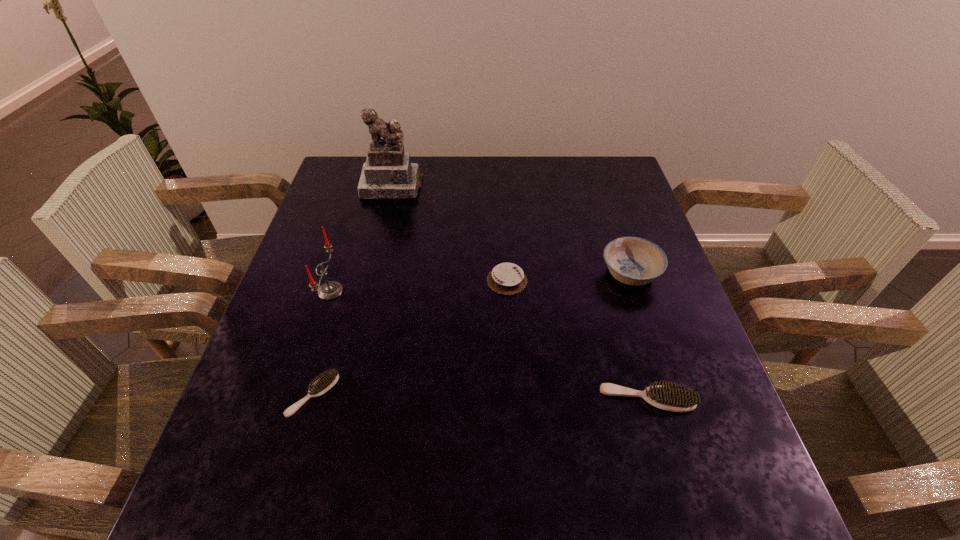
This screenshot has height=540, width=960. I want to click on empty space between the fifth shortest object and the tallest object, so click(361, 238).

At what (x,y) coordinates should I click in order to perform the action: click on blank region between the left scrubbing brush and the fourth object from left to right. Please return your answer as a coordinate pair (x, y). This screenshot has width=960, height=540. Looking at the image, I should click on (410, 338).

Where is `free space between the candle and the shorter scrubbing brush`? This screenshot has width=960, height=540. free space between the candle and the shorter scrubbing brush is located at coordinates (322, 343).

The image size is (960, 540). I want to click on free space between the third tallest object and the second tallest object, so click(480, 282).

Where is `free space between the third shortest object and the figurine`? The height and width of the screenshot is (540, 960). free space between the third shortest object and the figurine is located at coordinates click(519, 293).

Identify the location of vacant area that lies between the second tallest object and the third object from right to left. (419, 286).

What are the coordinates of `unoccupied area between the taller scrubbing brush and the third object from right to left` in the screenshot? It's located at (577, 340).

In order to click on free spot between the taller scrubbing brush and the figurine in this screenshot , I will do `click(519, 293)`.

Select which object appears as the closest to the second tallest object. Please provide its 2D coordinates. Your answer should be formatted as a tuple, i.e. [(x, y)], where the tuple contains the x and y coordinates of a point satisfying the conditions above.

[(327, 380)]

Identify which object is located as the third nearest to the shorter scrubbing brush. Please provide its 2D coordinates. Your answer should be formatted as a tuple, i.e. [(x, y)], where the tuple contains the x and y coordinates of a point satisfying the conditions above.

[(675, 398)]